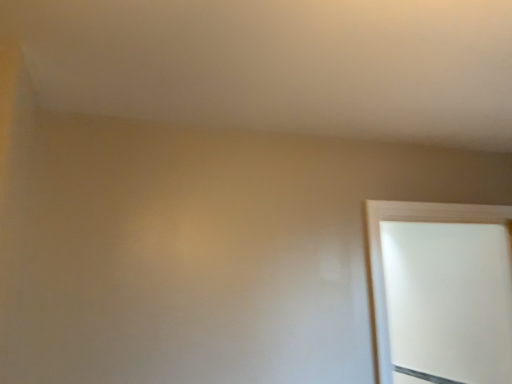
What do you see at coordinates (381, 255) in the screenshot? The width and height of the screenshot is (512, 384). I see `white glossy door at right` at bounding box center [381, 255].

What is the approximate width of white glossy door at right?

It is 2.79 inches.

Locate an element on the screen. white glossy door at right is located at coordinates (381, 255).

Where is `white glossy door at right`? Image resolution: width=512 pixels, height=384 pixels. white glossy door at right is located at coordinates (381, 255).